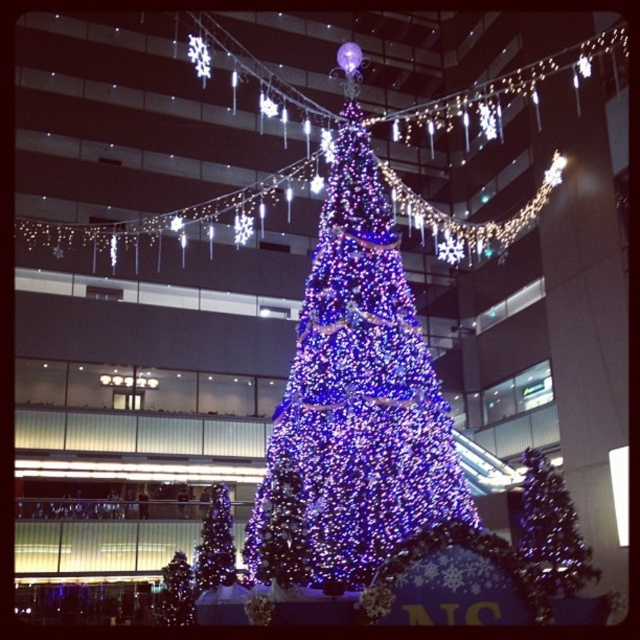
In the scene shown: Is iridescent glass christmas tree at center shorter than blue glittering christmas tree at center?

Incorrect, iridescent glass christmas tree at center's height does not fall short of blue glittering christmas tree at center's.

Based on the photo, can you confirm if iridescent glass christmas tree at center is bigger than blue glittering christmas tree at center?

Correct, iridescent glass christmas tree at center is larger in size than blue glittering christmas tree at center.

Is point (529, 532) more distant than point (209, 531)?

No, (529, 532) is closer to viewer.

Identify the location of iridescent glass christmas tree at center. (552, 531).

Is blue glittering christmas tree at center further to the viewer compared to iridescent glass christmas tree at lower left?

No, blue glittering christmas tree at center is in front of iridescent glass christmas tree at lower left.

Is blue glittering christmas tree at center shorter than iridescent glass christmas tree at lower left?

Yes.

Which is behind, point (216, 580) or point (157, 625)?

Positioned behind is point (157, 625).

The height and width of the screenshot is (640, 640). What are the coordinates of `blue glittering christmas tree at center` in the screenshot? It's located at [216, 545].

Does iridescent glass christmas tree at center have a lesser height compared to iridescent glass christmas tree at lower left?

No, iridescent glass christmas tree at center is not shorter than iridescent glass christmas tree at lower left.

This screenshot has width=640, height=640. I want to click on iridescent glass christmas tree at center, so click(x=552, y=531).

The height and width of the screenshot is (640, 640). Find the location of `iridescent glass christmas tree at center`. iridescent glass christmas tree at center is located at coordinates (552, 531).